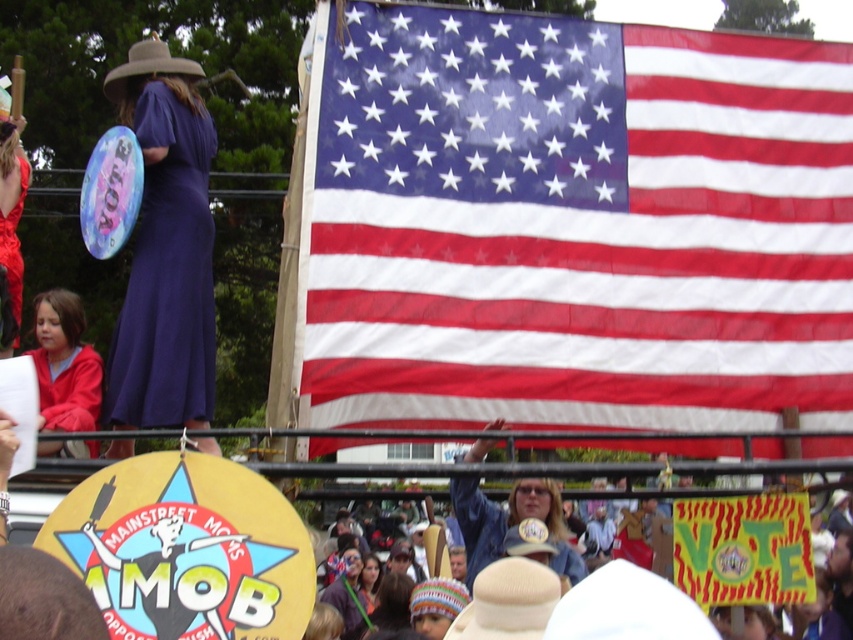
Question: Which point is closer to the camera?

Choices:
 (A) (0, 241)
 (B) (173, 88)
 (C) (807, 200)
 (D) (45, 298)

Answer: (B)

Question: Does red-white-and-blue fabric at upper center appear under purple matte dress at left?

Choices:
 (A) no
 (B) yes

Answer: (A)

Question: Can you confirm if red fleece jacket at left is positioned to the left of matte purple dress at upper left?

Choices:
 (A) no
 (B) yes

Answer: (A)

Question: Which object appears closest to the camera in this image?

Choices:
 (A) purple matte dress at left
 (B) red-white-and-blue fabric at upper center
 (C) matte purple dress at upper left

Answer: (A)

Question: Is red-white-and-blue fabric at upper center below matte purple dress at upper left?

Choices:
 (A) yes
 (B) no

Answer: (B)

Question: Which point is farther to the camera?

Choices:
 (A) red-white-and-blue fabric at upper center
 (B) matte purple dress at upper left

Answer: (B)